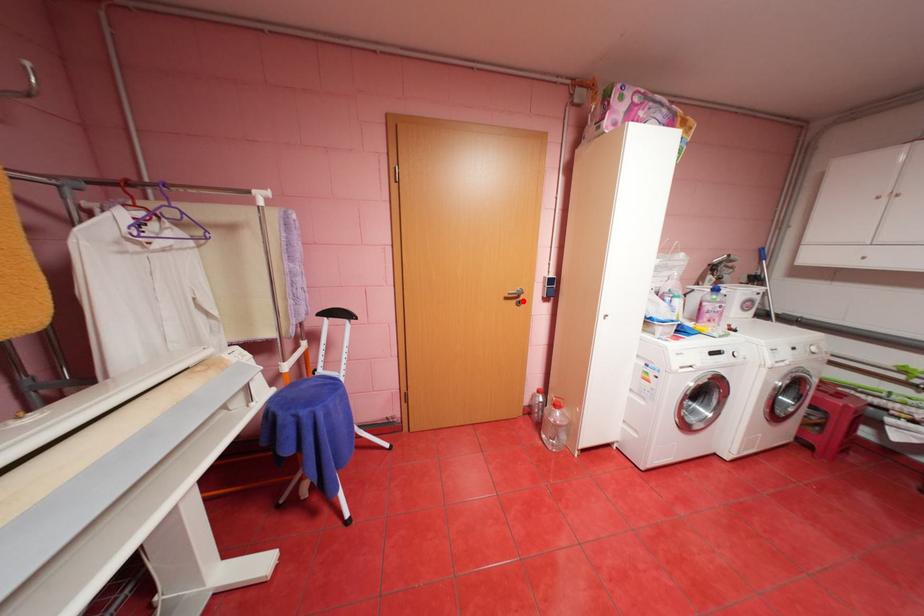
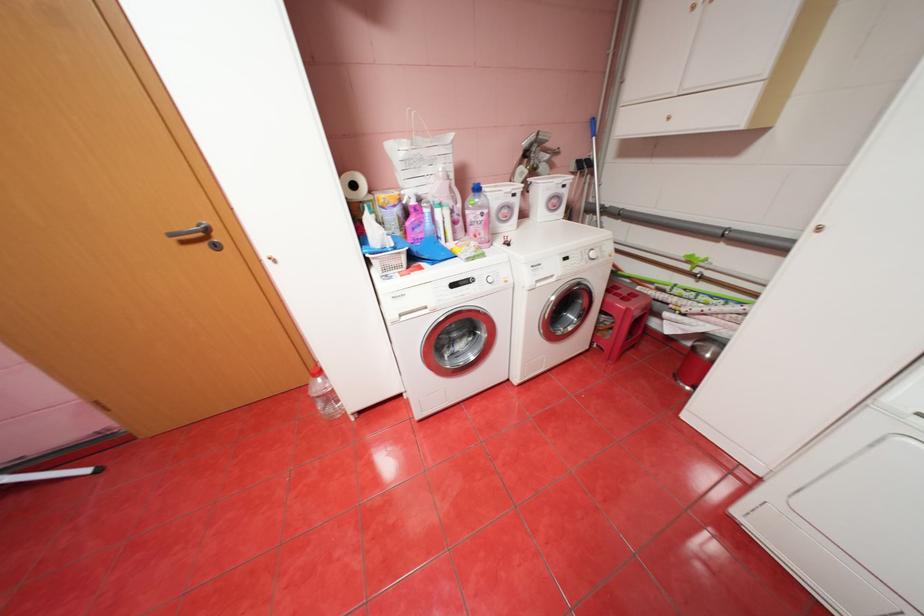
In the second image, find the point that corresponds to the highlighted location in the first image.

(213, 245)